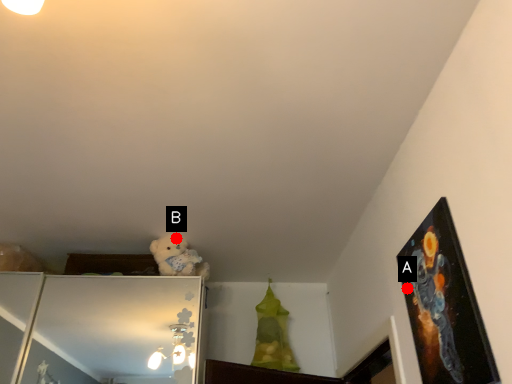
Question: Two points are circled on the image, labeled by A and B beside each circle. Which point appears farthest from the camera in this image?

Choices:
 (A) A is further
 (B) B is further

Answer: (B)